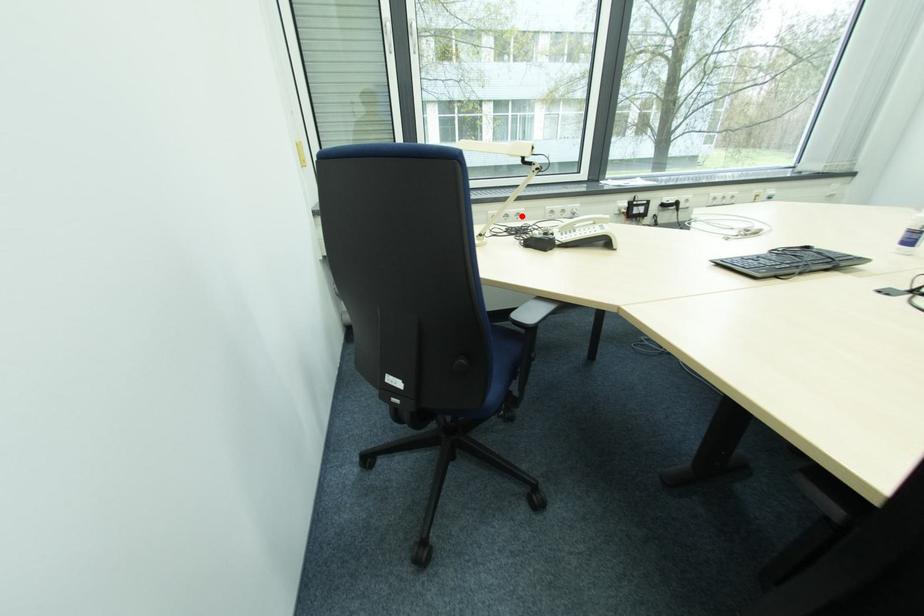
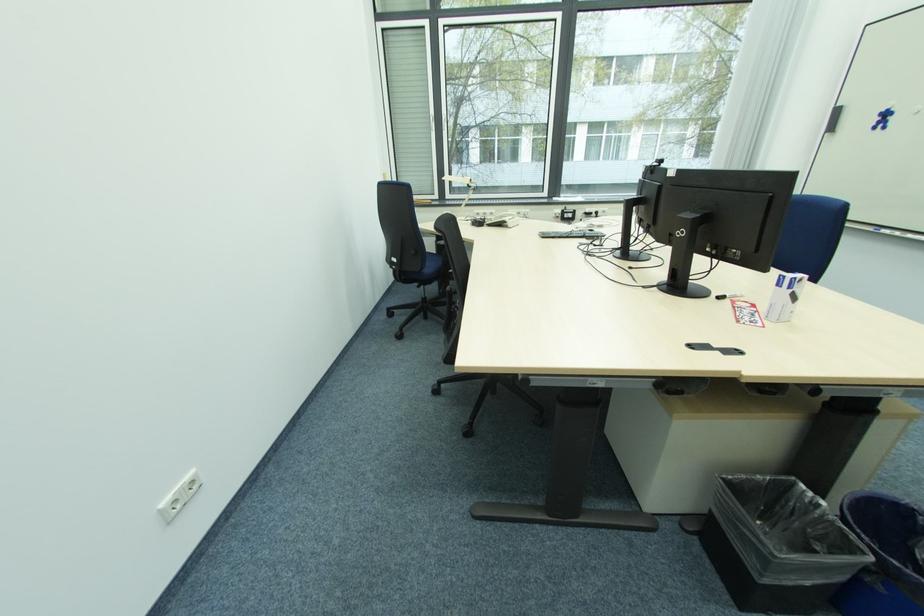
The point at the highlighted location is marked in the first image. Where is the corresponding point in the second image?

(494, 216)